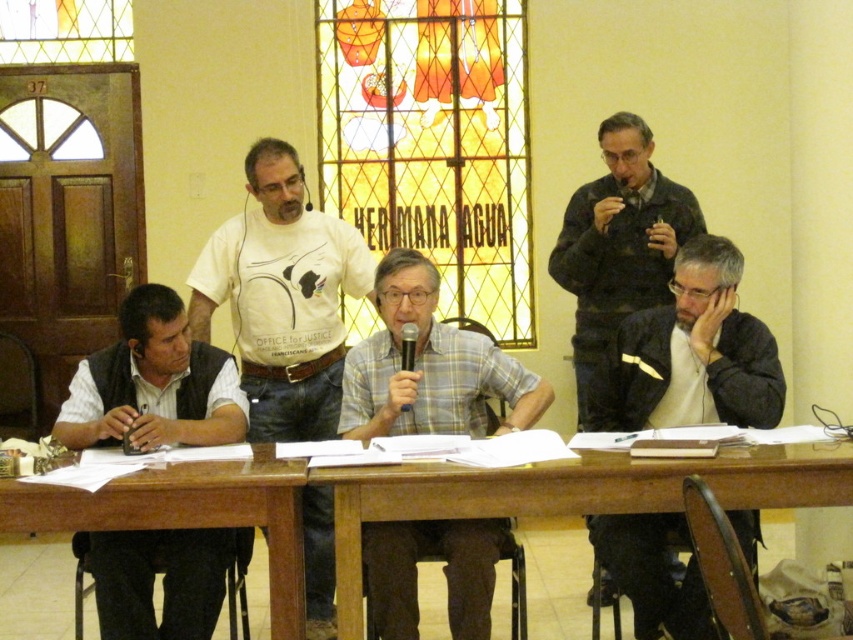
Question: Which of the following is the farthest from the observer?

Choices:
 (A) (144, 304)
 (B) (802, 477)

Answer: (A)

Question: Can you confirm if plaid fabric shirt at center is positioned to the right of black plastic microphone at center?

Choices:
 (A) no
 (B) yes

Answer: (B)

Question: Can you confirm if white shirt at left is bigger than plaid fabric shirt at center?

Choices:
 (A) yes
 (B) no

Answer: (B)

Question: Among these objects, which one is nearest to the camera?

Choices:
 (A) stained glass window at center
 (B) white shirt at left
 (C) brown wooden table at lower left
 (D) wooden table at center

Answer: (C)

Question: Considering the relative positions of dark gray jacket at right and wooden table at center in the image provided, where is dark gray jacket at right located with respect to wooden table at center?

Choices:
 (A) above
 (B) below

Answer: (A)

Question: Which point appears closest to the camera in this image?

Choices:
 (A) (515, 148)
 (B) (671, 388)
 (C) (491, 515)
 (D) (589, 330)

Answer: (C)